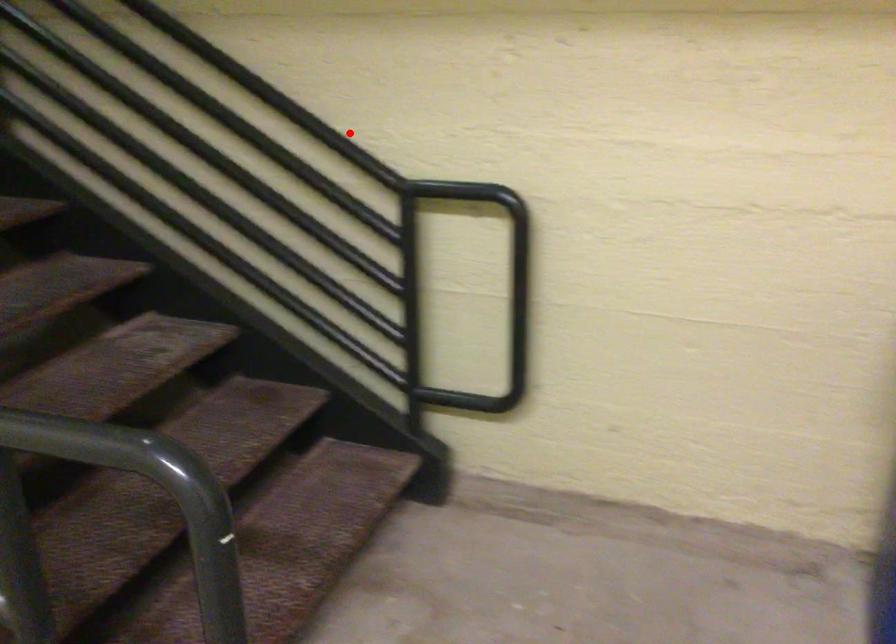
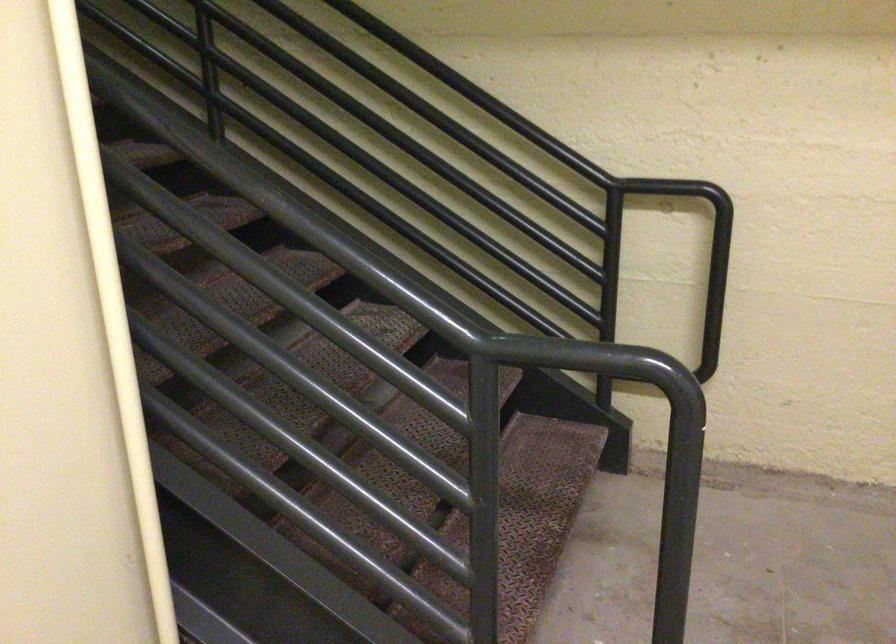
Question: I am providing you with two images of the same scene from different viewpoints. In image1, a red point is highlighted. Considering the same 3D point in image2, which of the following is correct?

Choices:
 (A) It is closer
 (B) It is farther

Answer: (B)